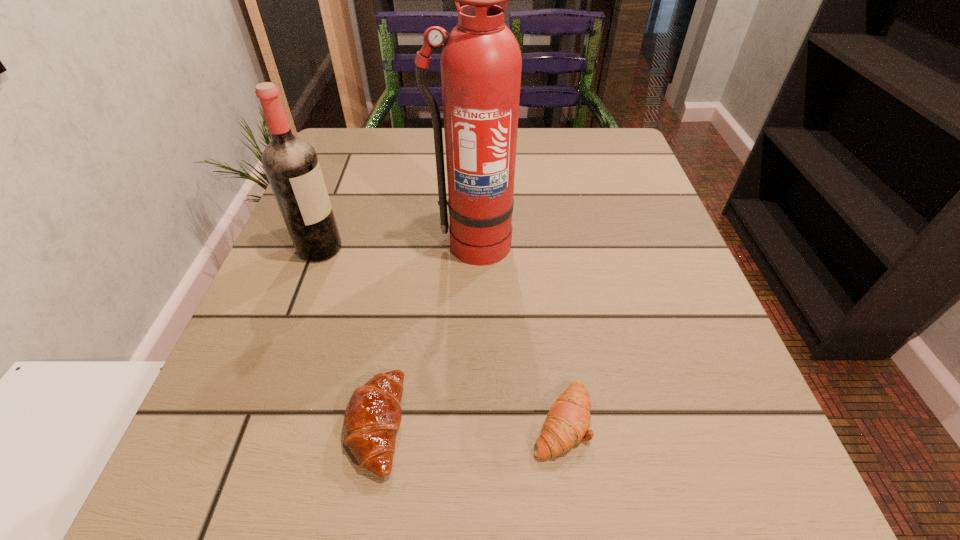
At what (x,y) coordinates should I click in order to perform the action: click on free spot located 0.320m on the back of the taller crescent roll. Please return your answer as a coordinate pair (x, y). The width and height of the screenshot is (960, 540). Looking at the image, I should click on pyautogui.click(x=409, y=234).

Locate an element on the screen. The height and width of the screenshot is (540, 960). vacant space situated on the back of the right crescent roll is located at coordinates (548, 319).

You are a GUI agent. You are given a task and a screenshot of the screen. Output one action in this format:
    pyautogui.click(x=<x>, y=<y>)
    Task: Click on the object that is at the left edge
    
    Given the screenshot: What is the action you would take?
    point(291,164)

Image resolution: width=960 pixels, height=540 pixels. In the image, there is a desktop. Identify the location of vacant space at the far edge. (559, 129).

Locate an element on the screen. The height and width of the screenshot is (540, 960). free space at the near edge of the desktop is located at coordinates (530, 454).

At what (x,y) coordinates should I click in order to perform the action: click on vacant space at the left edge of the desktop. Please return your answer as a coordinate pair (x, y). The height and width of the screenshot is (540, 960). Looking at the image, I should click on (271, 335).

Identify the location of free space at the right edge. tap(688, 379).

Where is `free spot at the far left corner of the desktop`? free spot at the far left corner of the desktop is located at coordinates click(370, 139).

You are a GUI agent. You are given a task and a screenshot of the screen. Output one action in this format:
    pyautogui.click(x=<x>, y=<y>)
    Task: Click on the vacant region at the far right corner
    This screenshot has width=960, height=540.
    Given the screenshot: What is the action you would take?
    pyautogui.click(x=632, y=161)

The image size is (960, 540). What are the coordinates of `free point between the second shortest object and the second object from right to left` in the screenshot? It's located at (423, 334).